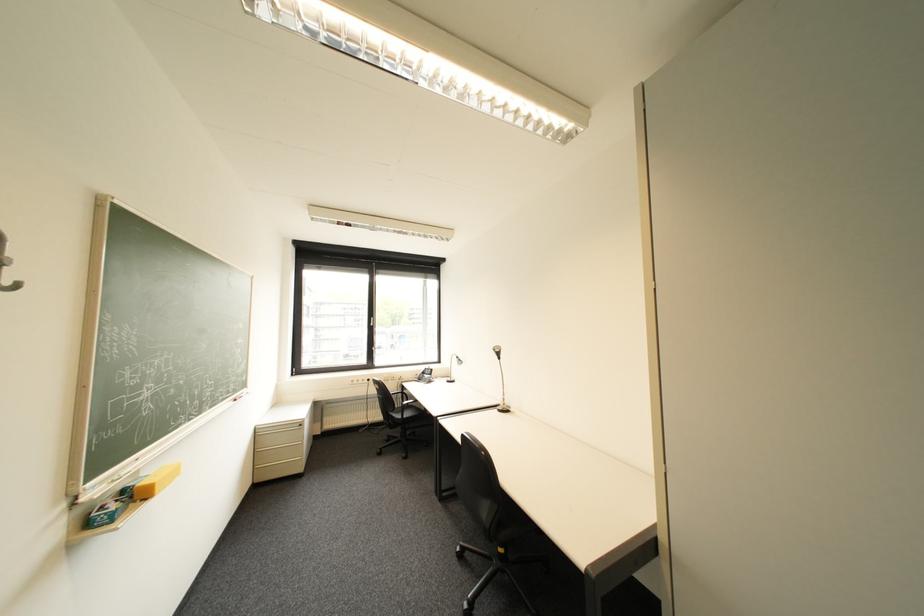
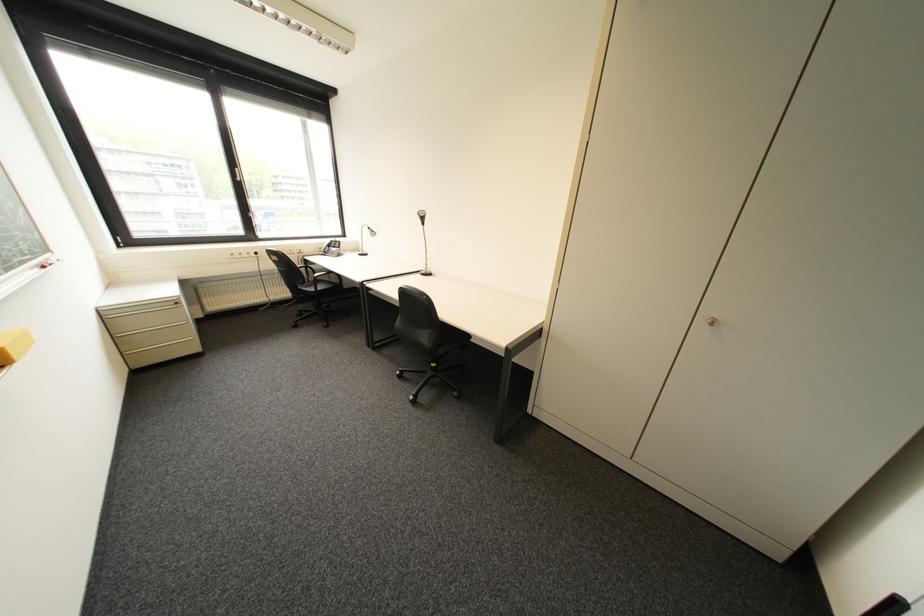
Where in the second image is the point corresponding to (x=382, y=325) from the first image?

(249, 180)